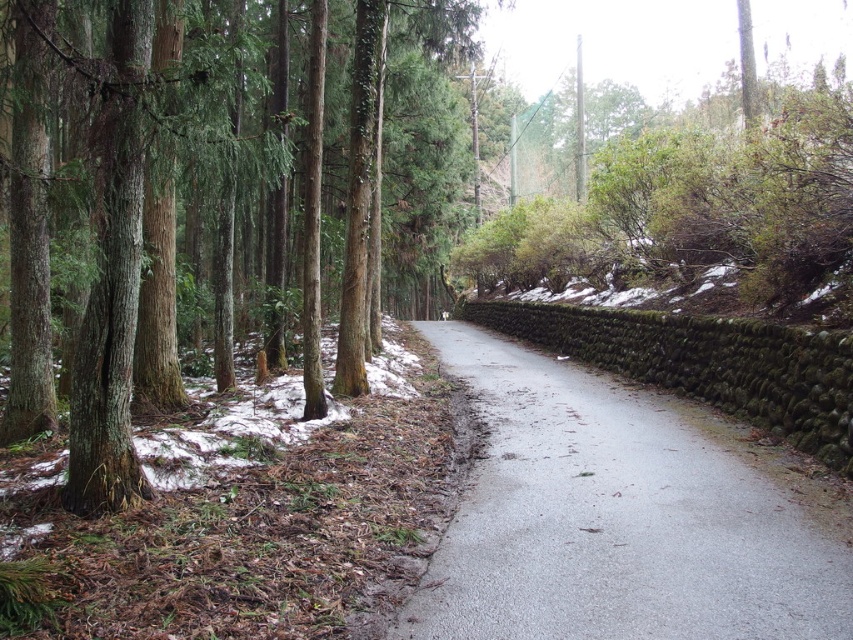
Question: Can you confirm if gray asphalt road at center is positioned below smooth brown tree trunk at left?

Choices:
 (A) yes
 (B) no

Answer: (A)

Question: Is gray asphalt road at center smaller than smooth brown tree trunk at left?

Choices:
 (A) yes
 (B) no

Answer: (A)

Question: Which of the following is the closest to the observer?

Choices:
 (A) gray asphalt road at center
 (B) smooth brown tree trunk at left

Answer: (A)

Question: Can you confirm if gray asphalt road at center is smaller than smooth brown tree trunk at left?

Choices:
 (A) no
 (B) yes

Answer: (B)

Question: Which point is closer to the camera?

Choices:
 (A) smooth brown tree trunk at left
 (B) gray asphalt road at center

Answer: (B)

Question: Which point is farther from the camera taking this photo?

Choices:
 (A) (769, 556)
 (B) (451, 125)

Answer: (B)